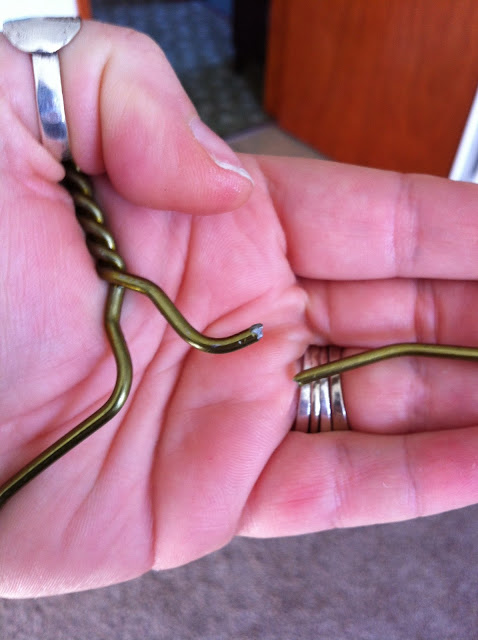
This screenshot has height=640, width=478. What are the coordinates of `floor` in the screenshot? It's located at (267, 150).